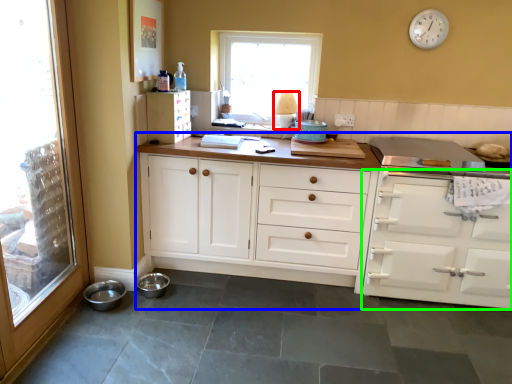
Question: Estimate the real-world distances between objects in this image. Which object is farther from lamp (highlighted by a red box), cabinetry (highlighted by a blue box) or cabinetry (highlighted by a green box)?

Choices:
 (A) cabinetry
 (B) cabinetry

Answer: (B)